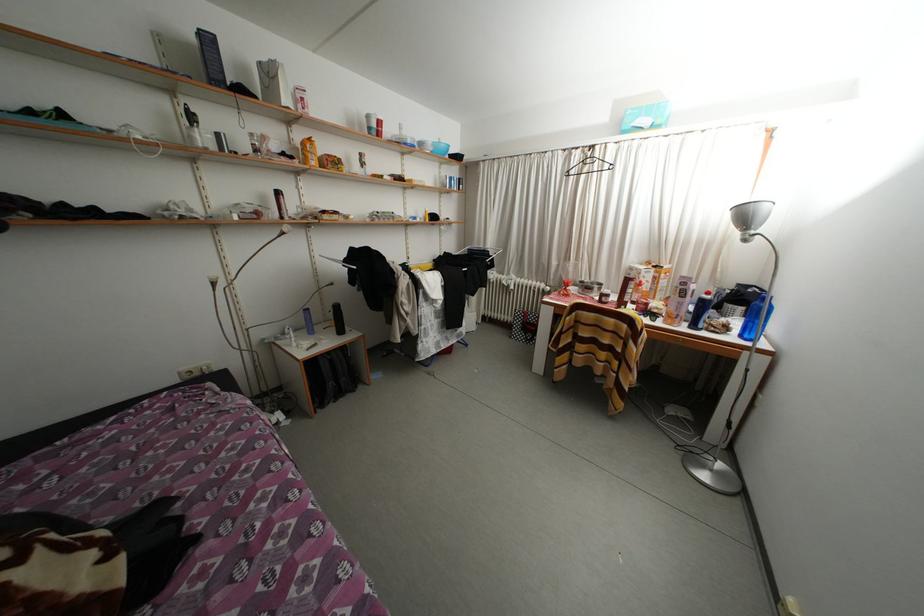
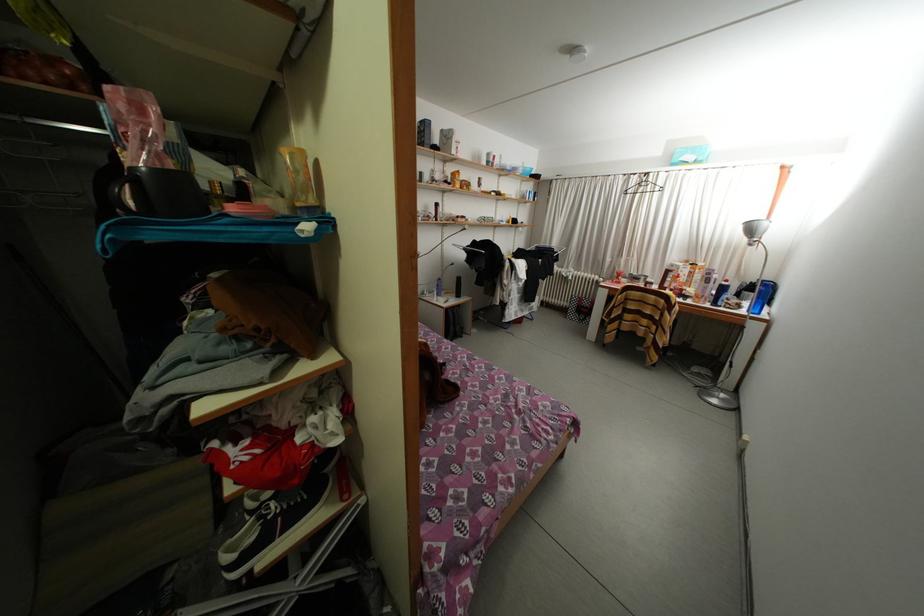
In the second image, find the point that corresponds to pixel 735 333 in the first image.

(747, 310)